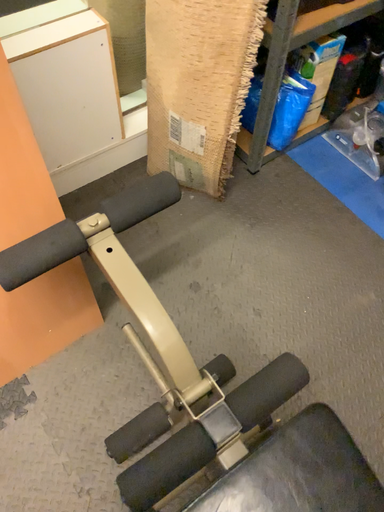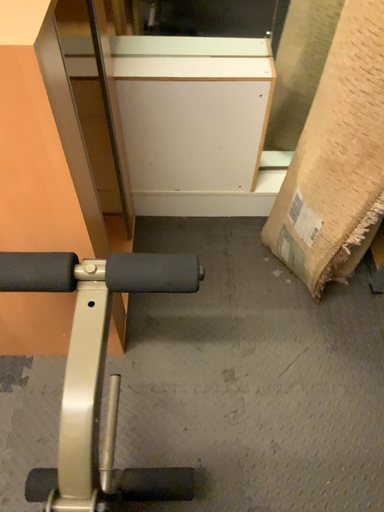
Question: Which way did the camera rotate in the video?

Choices:
 (A) rotated downward
 (B) rotated upward

Answer: (B)